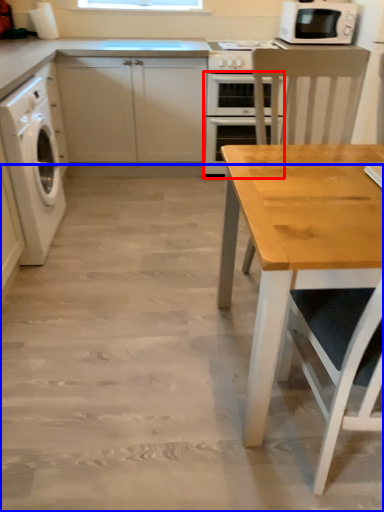
Question: Which of the following is the farthest to the observer, oven (highlighted by a red box) or concrete (highlighted by a blue box)?

Choices:
 (A) oven
 (B) concrete

Answer: (A)